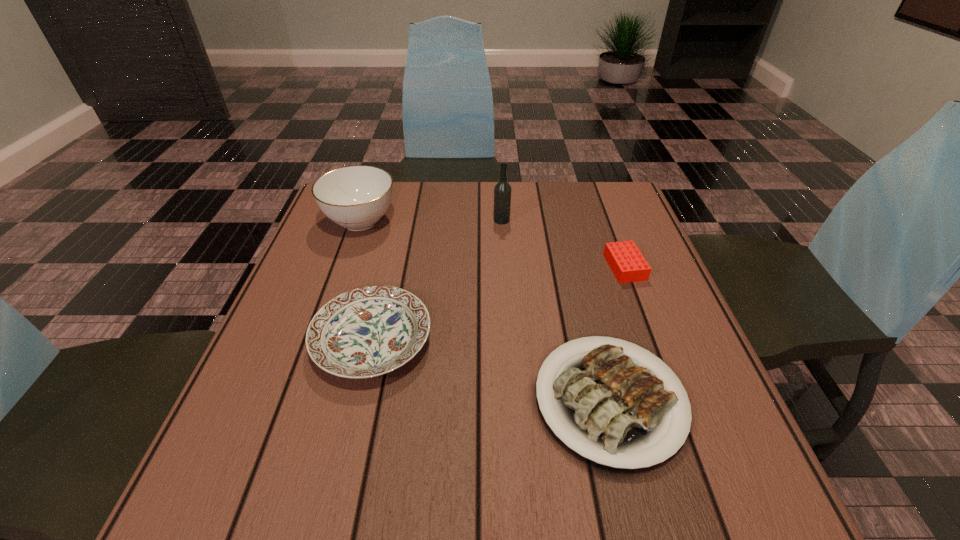
Where is `vacant area between the left plate and the right plate`? This screenshot has width=960, height=540. vacant area between the left plate and the right plate is located at coordinates (491, 370).

This screenshot has height=540, width=960. Find the location of `vacant area that lies between the vodka and the left plate`. vacant area that lies between the vodka and the left plate is located at coordinates (437, 280).

Find the location of a particular element. vacant area between the fourth shortest object and the right plate is located at coordinates (485, 310).

Where is `empty location between the chinaware and the left plate`? empty location between the chinaware and the left plate is located at coordinates (367, 281).

The image size is (960, 540). In order to click on vacant space that is in between the tallest object and the Lego in this screenshot , I will do `click(564, 244)`.

Identify which object is the third closest to the left plate. Please provide its 2D coordinates. Your answer should be formatted as a tuple, i.e. [(x, y)], where the tuple contains the x and y coordinates of a point satisfying the conditions above.

[(502, 192)]

Locate which object is the closest to the vodka. Please provide its 2D coordinates. Your answer should be formatted as a tuple, i.e. [(x, y)], where the tuple contains the x and y coordinates of a point satisfying the conditions above.

[(627, 263)]

At what (x,y) coordinates should I click in order to perform the action: click on blank space that satisfies the following two spatial constraints: 1. on the front side of the fourth shortest object; 2. on the left side of the Lego. Please return your answer as a coordinate pair (x, y). The image size is (960, 540). Looking at the image, I should click on (345, 267).

What are the coordinates of `free space that satisfies the following two spatial constraints: 1. on the front side of the second tallest object; 2. on the left side of the Lego` in the screenshot? It's located at (345, 267).

Locate an element on the screen. The height and width of the screenshot is (540, 960). free space that satisfies the following two spatial constraints: 1. on the back side of the chinaware; 2. on the left side of the tallest object is located at coordinates (361, 220).